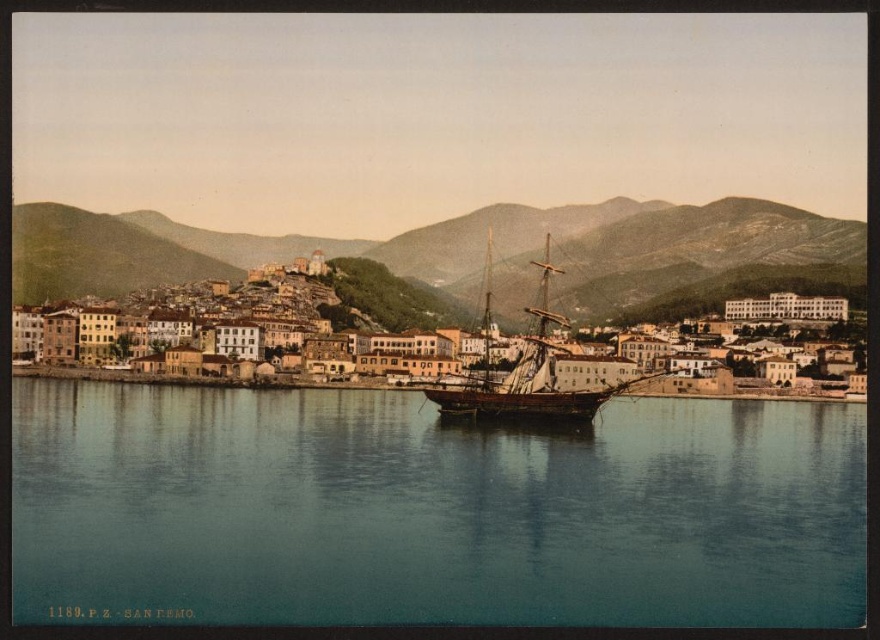
Which is more to the left, blue water at center or rocky brown mountain at center?

From the viewer's perspective, blue water at center appears more on the left side.

Is blue water at center positioned at the back of rocky brown mountain at center?

No.

Does point (376, 410) come behind point (259, 253)?

That is False.

The width and height of the screenshot is (880, 640). Find the location of `blue water at center`. blue water at center is located at coordinates (430, 509).

Is rocky brown mountain at center closer to camera compared to matte yellow building at center?

No, it is not.

From the picture: Can you confirm if rocky brown mountain at center is positioned below matte yellow building at center?

Incorrect, rocky brown mountain at center is not positioned below matte yellow building at center.

Between point (756, 253) and point (605, 376), which one is positioned in front?

Point (605, 376) is in front.

Where is `rocky brown mountain at center`? This screenshot has width=880, height=640. rocky brown mountain at center is located at coordinates (453, 252).

Measure the distance from matte yellow building at center to wooden ship at center.

10.02 meters

This screenshot has width=880, height=640. Identify the location of matte yellow building at center. (607, 376).

Is point (629, 358) less distant than point (510, 380)?

No, it is behind (510, 380).

At what (x,y) coordinates should I click in order to perform the action: click on matte yellow building at center. Please return your answer as a coordinate pair (x, y). Looking at the image, I should click on [607, 376].